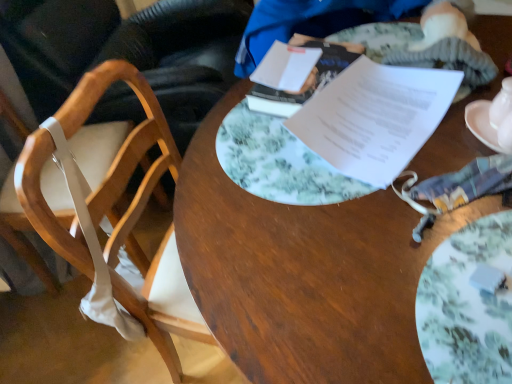
The height and width of the screenshot is (384, 512). Find the location of `free space behind white ceramic saucer at right`. free space behind white ceramic saucer at right is located at coordinates (447, 100).